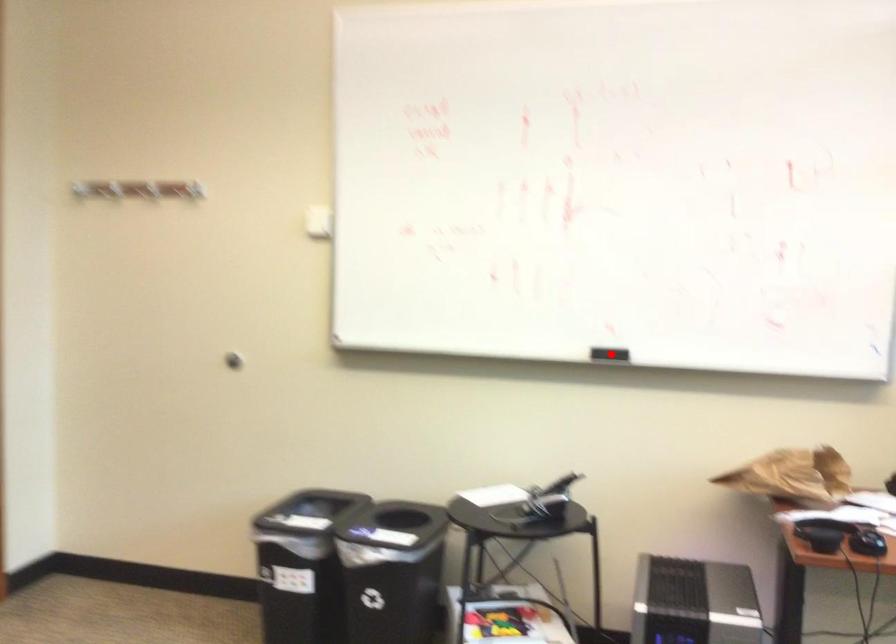
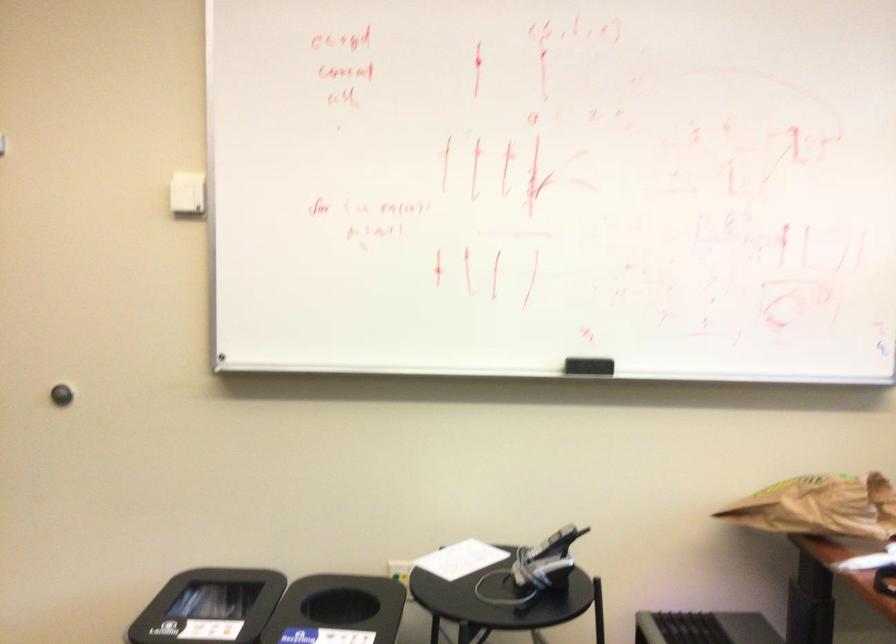
Question: I am providing you with two images of the same scene from different viewpoints. A red point is shown in image1. For the corresponding object point in image2, is it positioned nearer or farther from the camera?

Choices:
 (A) Nearer
 (B) Farther

Answer: (A)